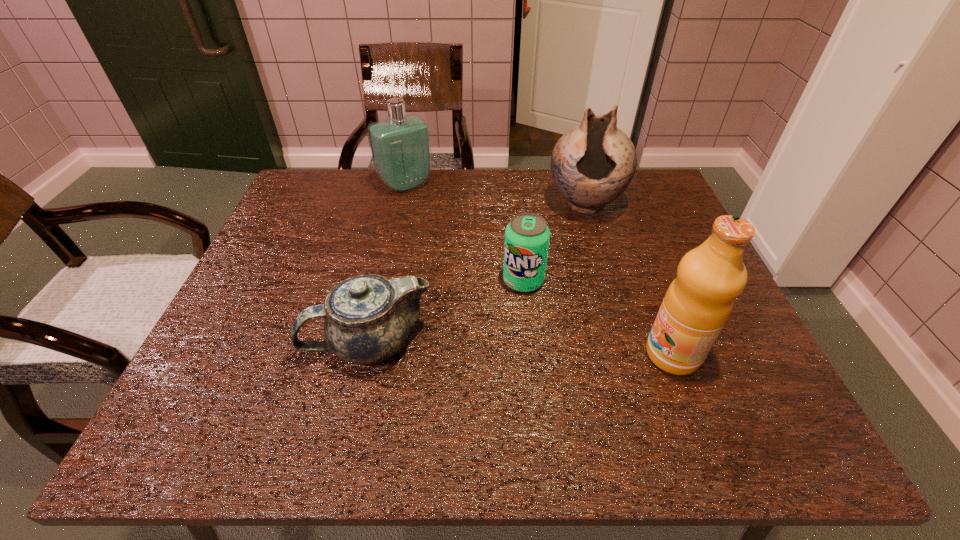
This screenshot has height=540, width=960. Identify the location of chinaware. (367, 318).

Locate an element on the screen. fruit juice is located at coordinates (699, 301).

Where is `pottery`? pottery is located at coordinates pyautogui.click(x=592, y=164).

At what (x,y) coordinates should I click in order to perform the action: click on the third object from left to right. Please return your answer as a coordinate pair (x, y). Image resolution: width=960 pixels, height=540 pixels. Looking at the image, I should click on (527, 236).

I want to click on pop soda, so click(527, 236).

The height and width of the screenshot is (540, 960). What are the coordinates of `perfume` in the screenshot? It's located at (401, 151).

Locate an element on the screen. free spot located from the spout of the chinaware is located at coordinates (273, 342).

Identify the location of vacant region located 0.080m from the spout of the chinaware. (268, 342).

This screenshot has width=960, height=540. In order to click on free location located 0.160m from the spout of the chinaware in this screenshot , I will do `click(230, 342)`.

This screenshot has height=540, width=960. What are the coordinates of `free space located on the front label of the fruit juice` in the screenshot? It's located at (547, 354).